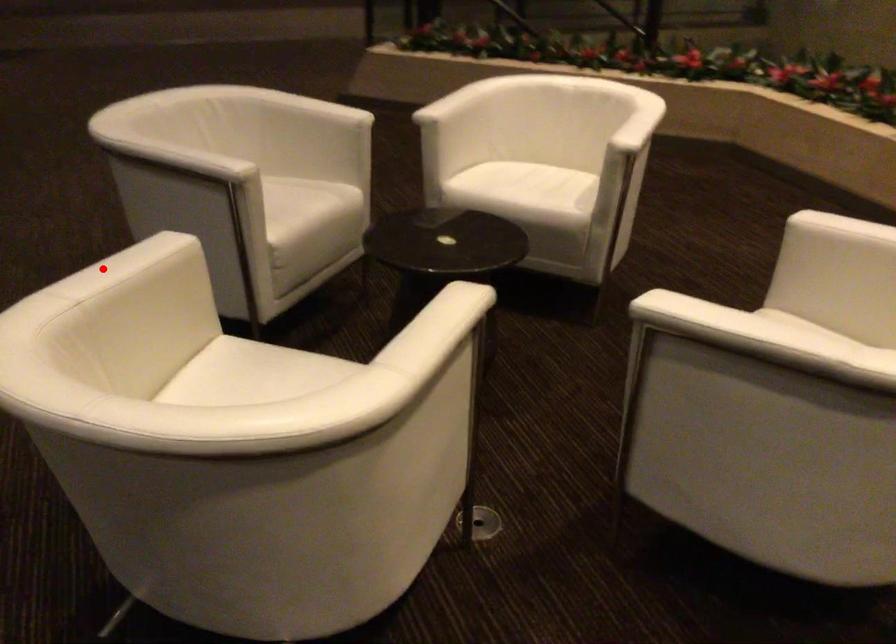
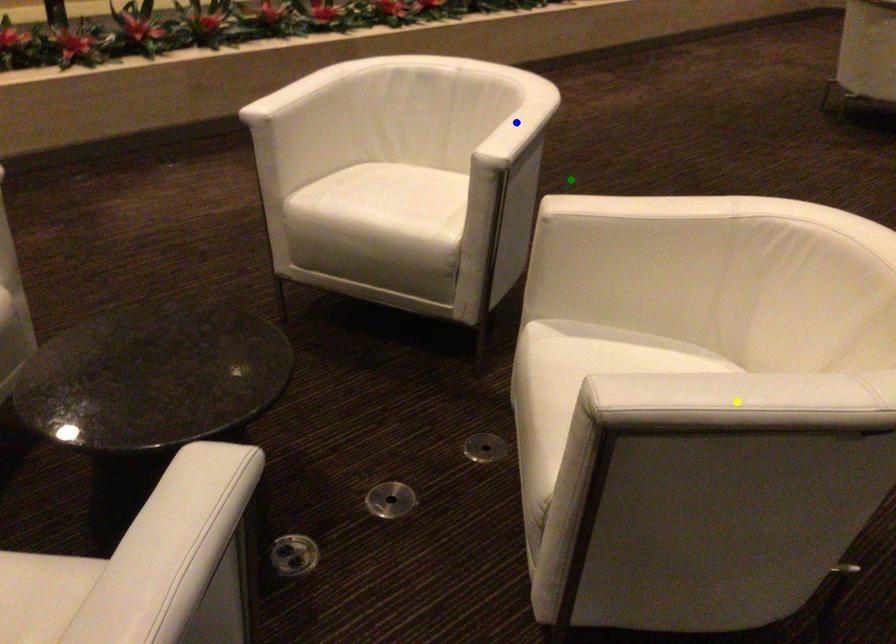
Question: I am providing you with two images of the same scene from different viewpoints. A red point is marked on the first image. You are given multiple points on the second image. Which mark in image 2 goes with the point in image 1?

Choices:
 (A) yellow point
 (B) green point
 (C) blue point

Answer: (A)